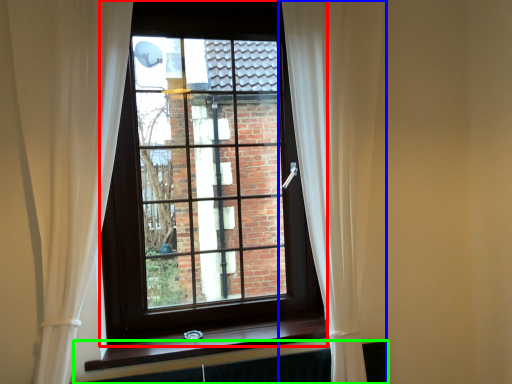
Question: Based on their relative distances, which object is farther from window (highlighted by a red box)? Choose from curtain (highlighted by a blue box) and radiator (highlighted by a green box).

Choices:
 (A) curtain
 (B) radiator

Answer: (B)